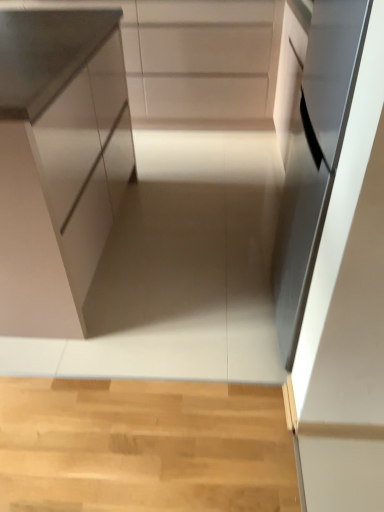
Question: Which direction should I rotate to face white matte cabinet at upper center, positioned as the second cabinetry in front-to-back order, — up or down?

Choices:
 (A) up
 (B) down

Answer: (A)

Question: From a real-world perspective, does white matte cabinet at upper center, marked as the 1th cabinetry in a back-to-front arrangement, stand above satin white cabinet at left, the second cabinetry when ordered from top to bottom?

Choices:
 (A) no
 (B) yes

Answer: (A)

Question: Can you confirm if white matte cabinet at upper center, positioned as the second cabinetry in front-to-back order, is positioned to the right of satin white cabinet at left, which is the 1th cabinetry in bottom-to-top order?

Choices:
 (A) yes
 (B) no

Answer: (A)

Question: Is white matte cabinet at upper center, positioned as the second cabinetry in front-to-back order, outside of satin white cabinet at left, the first cabinetry positioned from the front?

Choices:
 (A) no
 (B) yes

Answer: (B)

Question: Can you confirm if white matte cabinet at upper center, positioned as the first cabinetry in top-to-bottom order, is bigger than satin white cabinet at left, the second cabinetry when ordered from top to bottom?

Choices:
 (A) yes
 (B) no

Answer: (B)

Question: Is white matte cabinet at upper center, marked as the 1th cabinetry in a back-to-front arrangement, positioned with its back to satin white cabinet at left, which is the 1th cabinetry in bottom-to-top order?

Choices:
 (A) yes
 (B) no

Answer: (B)

Question: Is white matte cabinet at upper center, the 2th cabinetry positioned from the bottom, aimed at satin white cabinet at left, the first cabinetry positioned from the front?

Choices:
 (A) no
 (B) yes

Answer: (B)

Question: Is satin black oven at right closer to camera compared to satin white cabinet at left, the second cabinetry when ordered from back to front?

Choices:
 (A) yes
 (B) no

Answer: (A)

Question: Is satin black oven at right outside satin white cabinet at left, the first cabinetry positioned from the front?

Choices:
 (A) yes
 (B) no

Answer: (A)

Question: Is satin black oven at right bigger than satin white cabinet at left, the second cabinetry when ordered from back to front?

Choices:
 (A) yes
 (B) no

Answer: (B)

Question: From the image's perspective, does satin black oven at right appear higher than satin white cabinet at left, the second cabinetry when ordered from back to front?

Choices:
 (A) yes
 (B) no

Answer: (B)

Question: From a real-world perspective, is satin black oven at right located higher than satin white cabinet at left, the second cabinetry when ordered from top to bottom?

Choices:
 (A) no
 (B) yes

Answer: (B)

Question: Does satin black oven at right appear on the left side of satin white cabinet at left, the second cabinetry when ordered from top to bottom?

Choices:
 (A) no
 (B) yes

Answer: (A)

Question: Could you tell me if satin black oven at right is facing white matte cabinet at upper center, marked as the 1th cabinetry in a back-to-front arrangement?

Choices:
 (A) no
 (B) yes

Answer: (A)